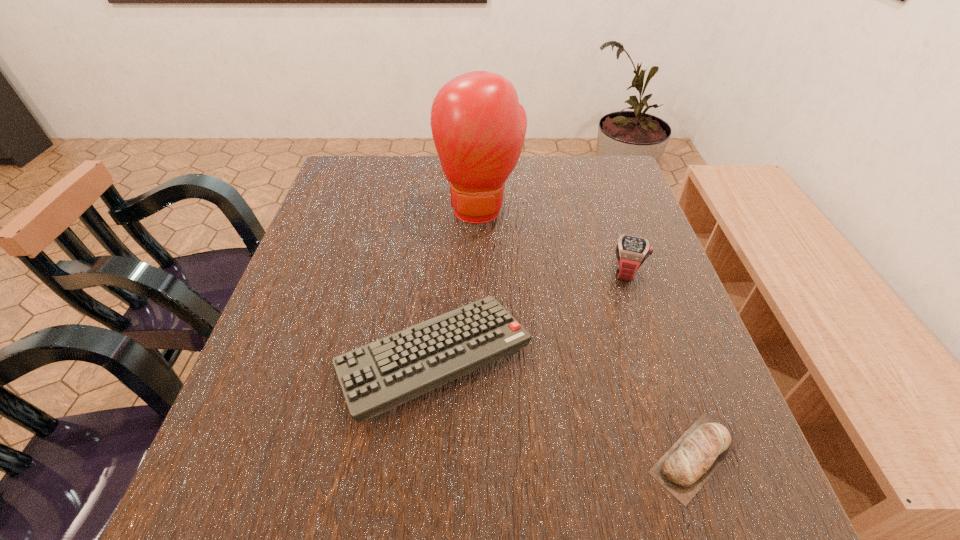
Identify the location of vacant space at the near left corner of the desktop. (294, 525).

The height and width of the screenshot is (540, 960). In order to click on vacant space at the far right corner in this screenshot , I will do `click(605, 160)`.

Find the location of `vacant region between the shortest object and the second tallest object`. vacant region between the shortest object and the second tallest object is located at coordinates (660, 364).

I want to click on free point between the third nearest object and the farthest object, so click(554, 240).

Where is `unoccupied area between the shortest object and the watch`? unoccupied area between the shortest object and the watch is located at coordinates (660, 364).

Locate an element on the screen. The width and height of the screenshot is (960, 540). vacant point located between the second farthest object and the farthest object is located at coordinates (554, 240).

At what (x,y) coordinates should I click in order to perform the action: click on free spot between the computer keyboard and the tallest object. Please return your answer as a coordinate pair (x, y). Image resolution: width=960 pixels, height=540 pixels. Looking at the image, I should click on (457, 283).

The height and width of the screenshot is (540, 960). Find the location of `free space between the computer keyboard and the pita bread`. free space between the computer keyboard and the pita bread is located at coordinates (564, 407).

The image size is (960, 540). What are the coordinates of `vacant space in between the computer keyboard and the shortest object` in the screenshot? It's located at (564, 407).

Identify the location of vacant area that lies between the watch and the tallest object. The width and height of the screenshot is (960, 540). (554, 240).